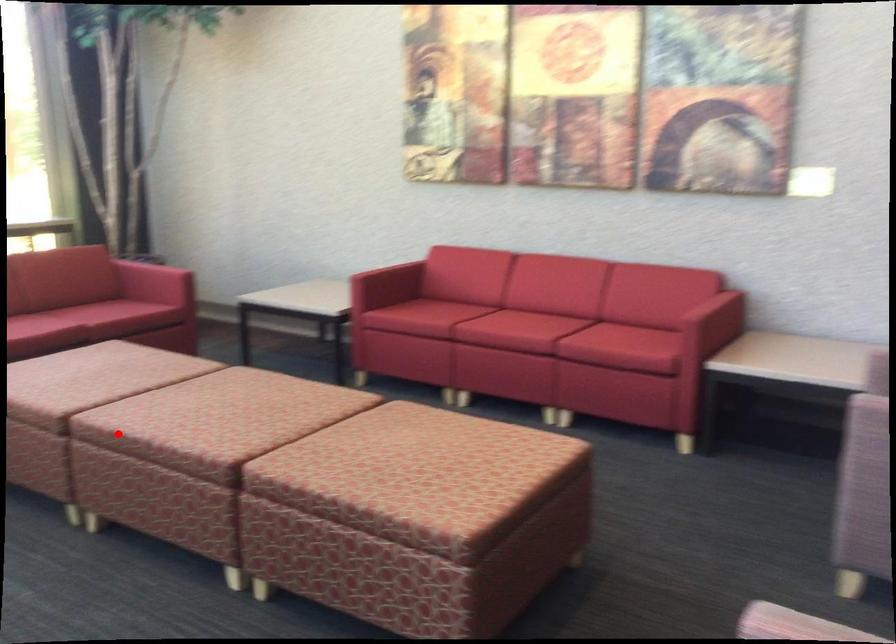
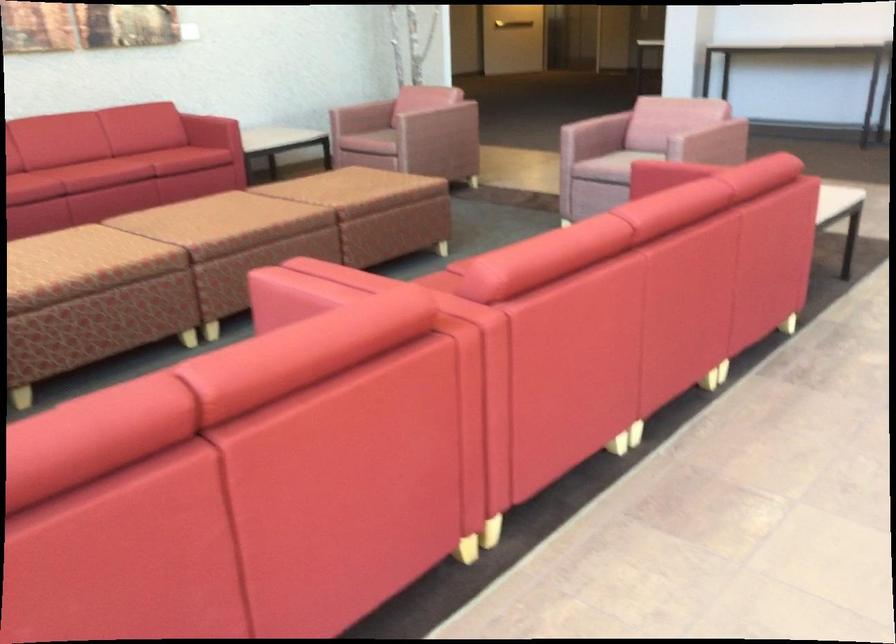
In the second image, find the point that corresponds to the highlighted location in the first image.

(254, 234)